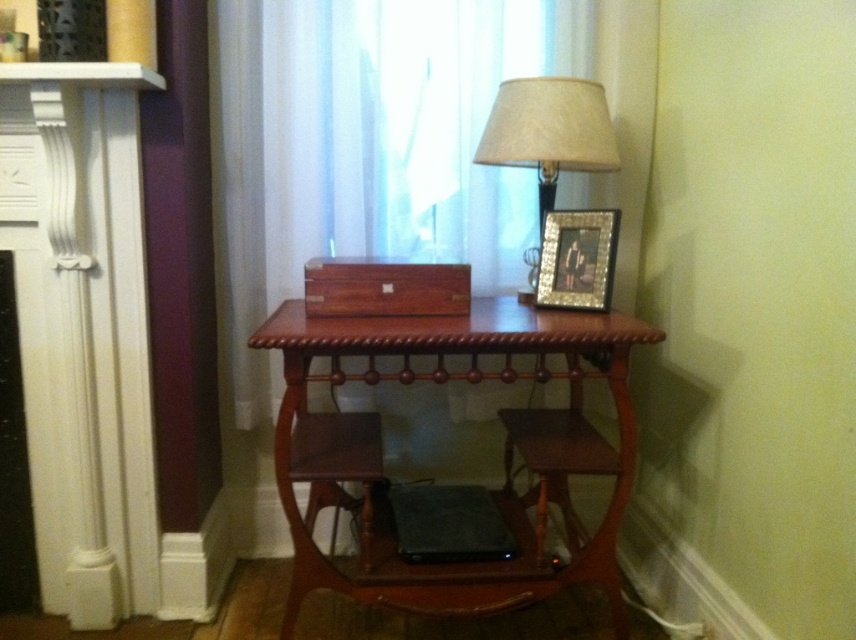
Does matte beige fabric lampshade at upper right appear on the right side of wooden stool at lower right?

Incorrect, matte beige fabric lampshade at upper right is not on the right side of wooden stool at lower right.

Describe the element at coordinates (550, 128) in the screenshot. This screenshot has width=856, height=640. I see `matte beige fabric lampshade at upper right` at that location.

Which is behind, point (569, 116) or point (550, 456)?

The point (569, 116) is behind.

Locate an element on the screen. matte beige fabric lampshade at upper right is located at coordinates (550, 128).

Who is more distant from viewer, (553, 344) or (497, 152)?

The point (497, 152) is more distant.

Does mahogany wood table at center have a larger size compared to matte beige fabric lampshade at upper right?

Correct, mahogany wood table at center is larger in size than matte beige fabric lampshade at upper right.

The image size is (856, 640). What do you see at coordinates (504, 454) in the screenshot?
I see `mahogany wood table at center` at bounding box center [504, 454].

Locate an element on the screen. The image size is (856, 640). mahogany wood table at center is located at coordinates (504, 454).

Which is more to the left, translucent fabric curtain at upper center or mahogany wood table at center?

translucent fabric curtain at upper center

Is point (254, 208) positioned before point (484, 586)?

No.

Between point (284, 81) and point (400, 321), which one is positioned behind?

Positioned behind is point (284, 81).

I want to click on translucent fabric curtain at upper center, so click(x=372, y=145).